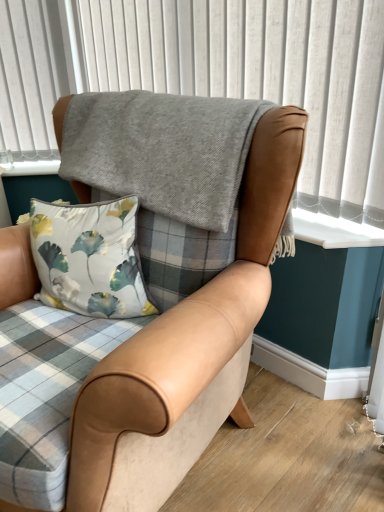
Measure the distance between gray woolen blanket at upper center and camera.

They are 1.09 meters apart.

At what (x,y) coordinates should I click in order to perform the action: click on gray woolen blanket at upper center. Please return your answer as a coordinate pair (x, y). This screenshot has height=512, width=384. Looking at the image, I should click on (212, 75).

In order to face gray woolen blanket at upper center, should I rotate leftwards or rightwards?

Turn right by 0.142 degrees to look at gray woolen blanket at upper center.

What do you see at coordinates (212, 75) in the screenshot? I see `gray woolen blanket at upper center` at bounding box center [212, 75].

Describe the element at coordinates (188, 325) in the screenshot. The height and width of the screenshot is (512, 384). I see `tan leather chair at center` at that location.

Locate an element on the screen. The width and height of the screenshot is (384, 512). tan leather chair at center is located at coordinates (188, 325).

Where is `gray woolen blanket at upper center`? The height and width of the screenshot is (512, 384). gray woolen blanket at upper center is located at coordinates (212, 75).

Considering the positions of objects tan leather chair at center and gray woolen blanket at upper center in the image provided, who is more to the left, tan leather chair at center or gray woolen blanket at upper center?

tan leather chair at center.

From the picture: Which object is further away from the camera, tan leather chair at center or gray woolen blanket at upper center?

gray woolen blanket at upper center is more distant.

Between point (211, 334) and point (165, 90), which one is positioned behind?

The point (165, 90) is more distant.

From the image's perspective, does tan leather chair at center appear lower than gray woolen blanket at upper center?

Yes.

From a real-world perspective, between tan leather chair at center and gray woolen blanket at upper center, who is vertically higher?

gray woolen blanket at upper center, from a real-world perspective.

Does tan leather chair at center have a lesser width compared to gray woolen blanket at upper center?

No, tan leather chair at center is not thinner than gray woolen blanket at upper center.

Is tan leather chair at center taller than gray woolen blanket at upper center?

Indeed, tan leather chair at center has a greater height compared to gray woolen blanket at upper center.

Consider the image. Is tan leather chair at center smaller than gray woolen blanket at upper center?

No, tan leather chair at center is not smaller than gray woolen blanket at upper center.

Which is correct: tan leather chair at center is inside gray woolen blanket at upper center, or outside of it?

tan leather chair at center is outside gray woolen blanket at upper center.

Is tan leather chair at center not near gray woolen blanket at upper center?

No, tan leather chair at center is in close proximity to gray woolen blanket at upper center.

Is tan leather chair at center facing towards gray woolen blanket at upper center?

No, tan leather chair at center is not oriented towards gray woolen blanket at upper center.

Can you tell me how much tan leather chair at center and gray woolen blanket at upper center differ in facing direction?

0.301 degrees.

This screenshot has height=512, width=384. I want to click on window frame that appears on the right of tan leather chair at center, so click(212, 75).

Consider the image. Considering the positions of objects gray woolen blanket at upper center and tan leather chair at center in the image provided, who is more to the left, gray woolen blanket at upper center or tan leather chair at center?

From the viewer's perspective, tan leather chair at center appears more on the left side.

Considering the positions of objects gray woolen blanket at upper center and tan leather chair at center in the image provided, who is behind, gray woolen blanket at upper center or tan leather chair at center?

gray woolen blanket at upper center.

Is point (237, 93) less distant than point (26, 257)?

That is False.

From the image's perspective, is gray woolen blanket at upper center above tan leather chair at center?

Yes.

From a real-world perspective, who is located lower, gray woolen blanket at upper center or tan leather chair at center?

From a 3D spatial view, tan leather chair at center is below.

In the scene shown: Is gray woolen blanket at upper center wider or thinner than tan leather chair at center?

gray woolen blanket at upper center is thinner than tan leather chair at center.

Who is taller, gray woolen blanket at upper center or tan leather chair at center?

Standing taller between the two is tan leather chair at center.

Based on their sizes in the image, would you say gray woolen blanket at upper center is bigger or smaller than tan leather chair at center?

Considering their sizes, gray woolen blanket at upper center takes up less space than tan leather chair at center.

Is tan leather chair at center a part of gray woolen blanket at upper center?

Definitely not — tan leather chair at center is not inside gray woolen blanket at upper center.

Is gray woolen blanket at upper center not near tan leather chair at center?

gray woolen blanket at upper center is near tan leather chair at center, not far away.

Consider the image. Could you tell me if gray woolen blanket at upper center is facing tan leather chair at center?

Yes, gray woolen blanket at upper center is oriented towards tan leather chair at center.

Can you tell me how much gray woolen blanket at upper center and tan leather chair at center differ in facing direction?

gray woolen blanket at upper center and tan leather chair at center are facing 0.301 degrees away from each other.

Locate an element on the screen. Image resolution: width=384 pixels, height=512 pixels. window frame positioned vertically above the tan leather chair at center (from a real-world perspective) is located at coordinates (212, 75).

The width and height of the screenshot is (384, 512). I want to click on window frame above the tan leather chair at center (from a real-world perspective), so click(212, 75).

The height and width of the screenshot is (512, 384). Find the location of `chair located on the left of gray woolen blanket at upper center`. chair located on the left of gray woolen blanket at upper center is located at coordinates (188, 325).